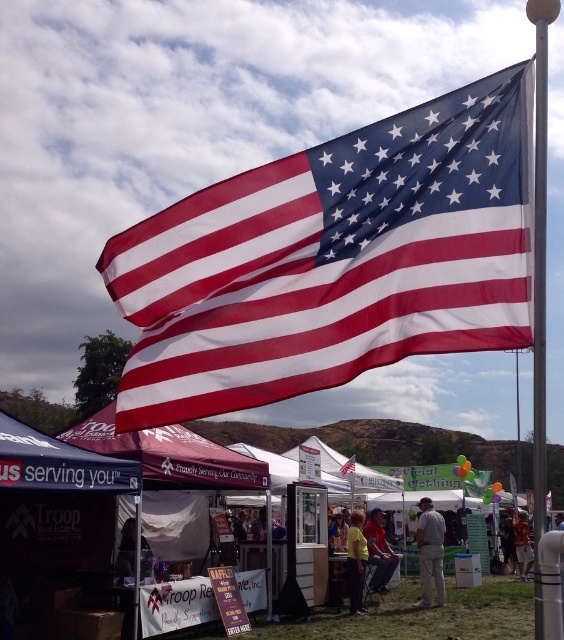
Question: Which of the following is the closest to the observer?

Choices:
 (A) red-white-blue fabric flag at upper center
 (B) reddish-brown leather jacket at center
 (C) red shirt at center

Answer: (C)

Question: Considering the real-world distances, which object is closest to the reddish-brown leather jacket at center?

Choices:
 (A) polyester american flag at upper center
 (B) yellow fabric shirt at center
 (C) red-white-blue fabric flag at upper center
 (D) dark brown leather jacket at center

Answer: (D)

Question: Based on their relative distances, which object is nearer to the dark brown leather jacket at center?

Choices:
 (A) red-white-blue fabric flag at upper center
 (B) yellow fabric shirt at center
 (C) red shirt at center

Answer: (A)

Question: Is polyester american flag at upper center bigger than red-white-blue fabric flag at upper center?

Choices:
 (A) no
 (B) yes

Answer: (A)

Question: Is polyester american flag at upper center closer to the viewer compared to red shirt at center?

Choices:
 (A) yes
 (B) no

Answer: (A)

Question: Does reddish-brown leather jacket at center appear on the left side of red-white-blue fabric flag at upper center?

Choices:
 (A) yes
 (B) no

Answer: (B)